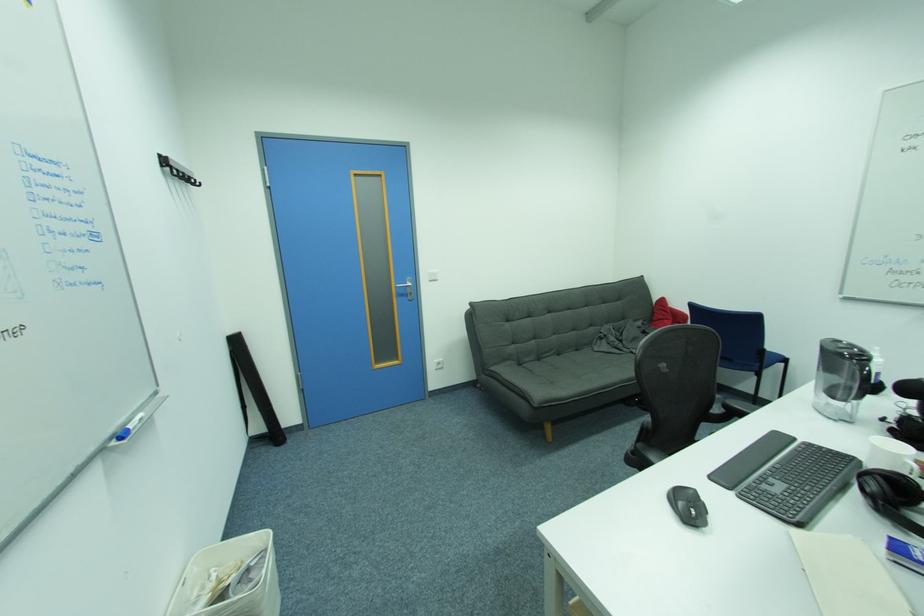
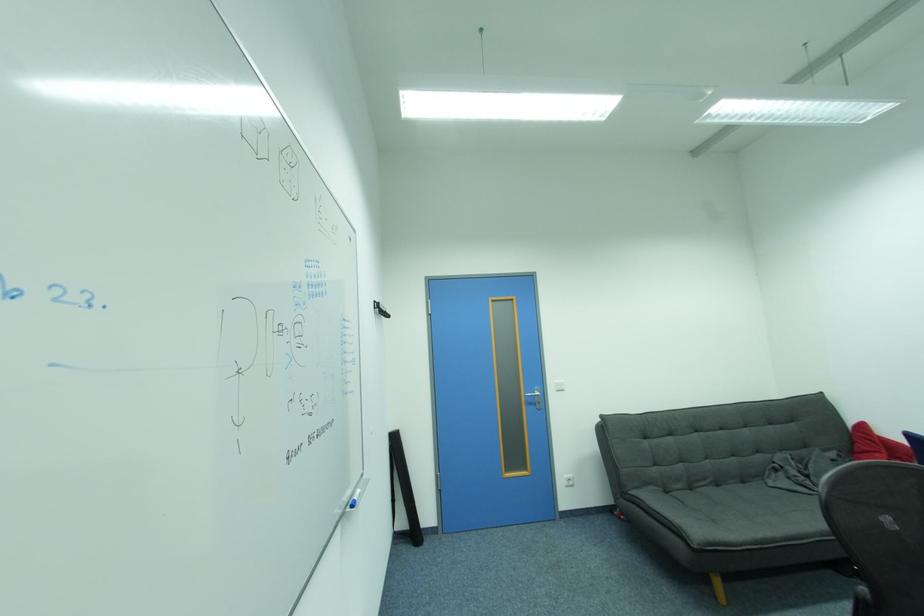
Find the pixel in the second image that matches point 436,272 in the first image.

(564, 382)